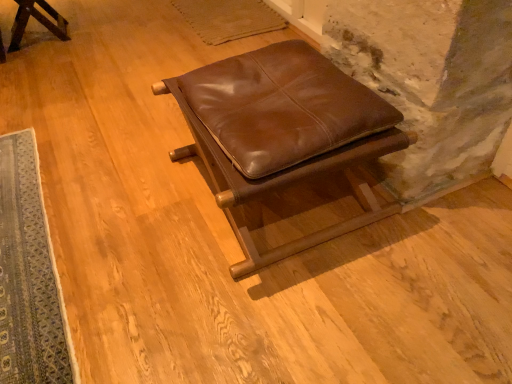
At what (x,y) coordinates should I click in order to perform the action: click on free space on the front side of matte brown leather stool at upper left, the 1th furniture in the back-to-front sequence. Please return your answer as a coordinate pair (x, y). Looking at the image, I should click on (48, 63).